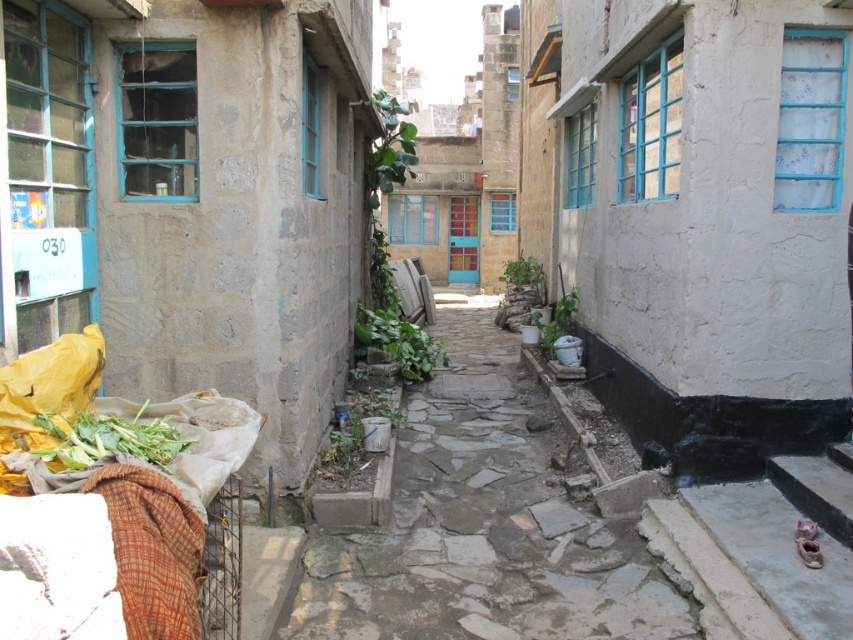
Which of these two, green leafy vegetables at lower left or green leafy plant at center, stands taller?

green leafy plant at center is taller.

Can you confirm if green leafy vegetables at lower left is taller than green leafy plant at center?

Incorrect, green leafy vegetables at lower left's height is not larger of green leafy plant at center's.

Is point (55, 413) farther from viewer compared to point (421, 346)?

No, (55, 413) is closer to viewer.

The width and height of the screenshot is (853, 640). What are the coordinates of `green leafy vegetables at lower left` in the screenshot? It's located at (109, 438).

Who is shorter, rusty metal planter at center or green leafy vegetables at lower left?

rusty metal planter at center

Is rusty metal planter at center below green leafy vegetables at lower left?

Correct, rusty metal planter at center is located below green leafy vegetables at lower left.

Who is more forward, (396,568) or (100,416)?

Point (100,416) is in front.

Identify the location of rusty metal planter at center. (483, 524).

Can you confirm if rusty metal planter at center is shorter than green leafy plant at center?

Indeed, rusty metal planter at center has a lesser height compared to green leafy plant at center.

Is rusty metal planter at center above green leafy plant at center?

Actually, rusty metal planter at center is below green leafy plant at center.

Find the location of a particular element. The height and width of the screenshot is (640, 853). rusty metal planter at center is located at coordinates (483, 524).